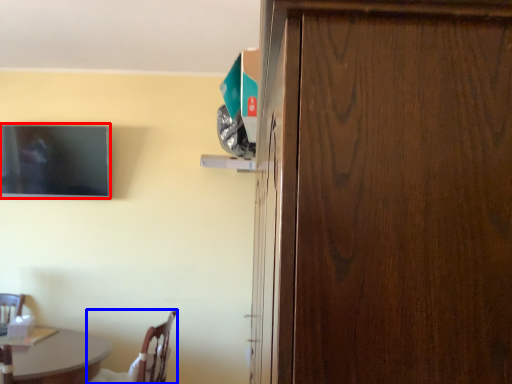
Question: Among these objects, which one is nearest to the camera, television (highlighted by a red box) or chair (highlighted by a blue box)?

Choices:
 (A) television
 (B) chair

Answer: (B)